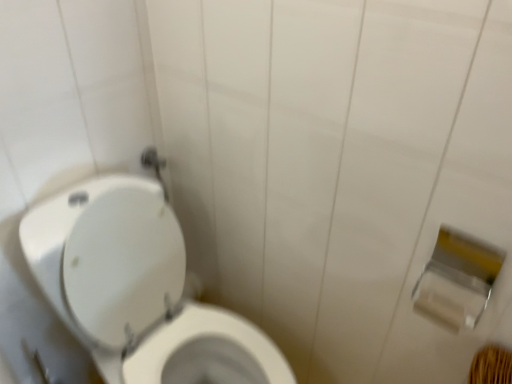
Question: In the image, is white matte toilet paper at right, positioned as the 2th toilet paper in top-to-bottom order, on the left side or the right side of white glossy toilet at left?

Choices:
 (A) right
 (B) left

Answer: (A)

Question: Choose the correct answer: Is white matte toilet paper at right, positioned as the 1th toilet paper in bottom-to-top order, inside white glossy toilet at left or outside it?

Choices:
 (A) outside
 (B) inside

Answer: (A)

Question: Which object is the farthest from the silver metallic toilet paper at right, the second toilet paper ordered from the bottom?

Choices:
 (A) white matte toilet paper at right, positioned as the 1th toilet paper in bottom-to-top order
 (B) white glossy toilet at left

Answer: (B)

Question: Which object is positioned closest to the white matte toilet paper at right, positioned as the 1th toilet paper in bottom-to-top order?

Choices:
 (A) silver metallic toilet paper at right, the second toilet paper ordered from the bottom
 (B) white glossy toilet at left

Answer: (A)